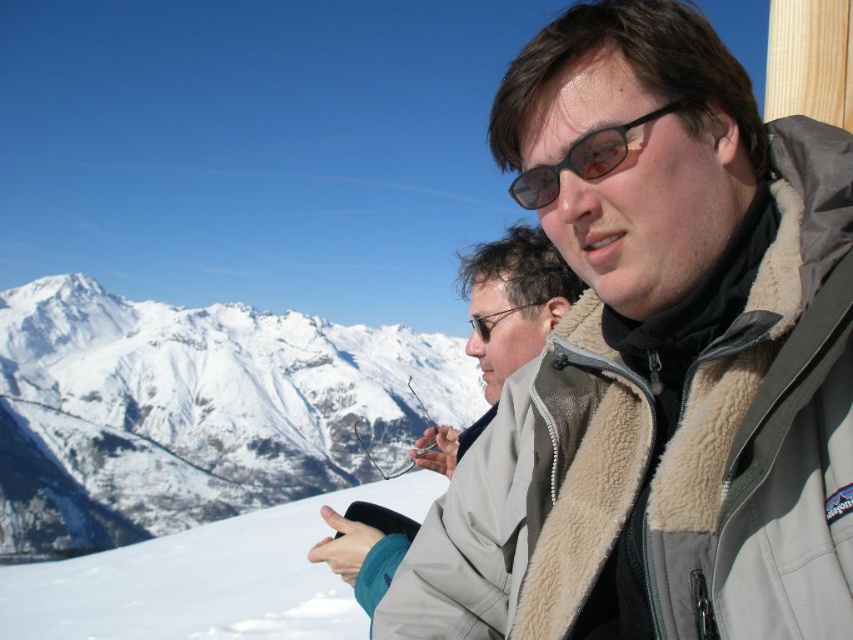
Question: Where is gray fleece jacket at upper right located in relation to white snow-covered mountain at upper left in the image?

Choices:
 (A) above
 (B) below

Answer: (A)

Question: Does gray fleece jacket at upper right appear on the left side of light beige jacket at center?

Choices:
 (A) no
 (B) yes

Answer: (A)

Question: Which point appears closest to the camera in this image?

Choices:
 (A) (51, 497)
 (B) (492, 339)

Answer: (B)

Question: Among these objects, which one is nearest to the camera?

Choices:
 (A) white fluffy snow at lower left
 (B) white snow-covered mountain at upper left

Answer: (A)

Question: Which point appears farthest from the camera in this image?

Choices:
 (A) (686, 104)
 (B) (572, 196)

Answer: (B)

Question: Does white snow-covered mountain at upper left come in front of light beige jacket at center?

Choices:
 (A) yes
 (B) no

Answer: (B)